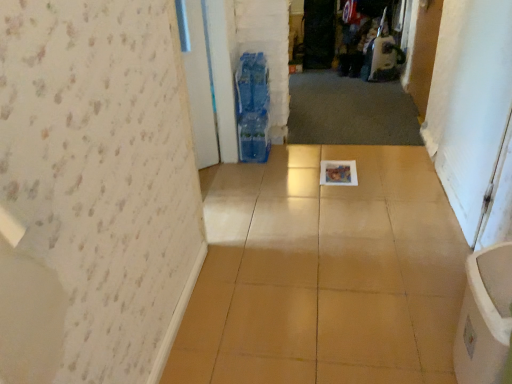
Question: Does white glossy screen door at right, the 2th screen door from the top, have a lesser width compared to wooden door at upper right?

Choices:
 (A) yes
 (B) no

Answer: (B)

Question: Is the depth of white glossy screen door at right, acting as the 1th screen door starting from the right, greater than that of wooden door at upper right?

Choices:
 (A) no
 (B) yes

Answer: (A)

Question: From the image's perspective, is white glossy screen door at right, positioned as the 1th screen door in bottom-to-top order, on top of wooden door at upper right?

Choices:
 (A) yes
 (B) no

Answer: (B)

Question: Is white glossy screen door at right, the 2th screen door from the top, wider than wooden door at upper right?

Choices:
 (A) no
 (B) yes

Answer: (B)

Question: Is white glossy screen door at right, which appears as the second screen door when viewed from the back, at the left side of wooden door at upper right?

Choices:
 (A) yes
 (B) no

Answer: (A)

Question: From a real-world perspective, does white glossy screen door at right, which is the 2th screen door in left-to-right order, sit lower than wooden door at upper right?

Choices:
 (A) yes
 (B) no

Answer: (B)

Question: From the image's perspective, is wooden door at upper right below transparent plastic screen door at center, the 1th screen door positioned from the back?

Choices:
 (A) no
 (B) yes

Answer: (B)

Question: Is wooden door at upper right wider than transparent plastic screen door at center, the second screen door in the bottom-to-top sequence?

Choices:
 (A) yes
 (B) no

Answer: (B)

Question: Does wooden door at upper right have a larger size compared to transparent plastic screen door at center, the first screen door from the top?

Choices:
 (A) yes
 (B) no

Answer: (B)

Question: Would you consider wooden door at upper right to be distant from transparent plastic screen door at center, the 2th screen door in the front-to-back sequence?

Choices:
 (A) yes
 (B) no

Answer: (A)

Question: Does wooden door at upper right lie behind transparent plastic screen door at center, which is counted as the first screen door, starting from the left?

Choices:
 (A) no
 (B) yes

Answer: (A)

Question: From the image's perspective, is wooden door at upper right over transparent plastic screen door at center, which is counted as the first screen door, starting from the left?

Choices:
 (A) no
 (B) yes

Answer: (A)

Question: Is white glossy screen door at right, which is the 1th screen door from front to back, not within transparent plastic screen door at center, which is counted as the first screen door, starting from the left?

Choices:
 (A) no
 (B) yes

Answer: (B)